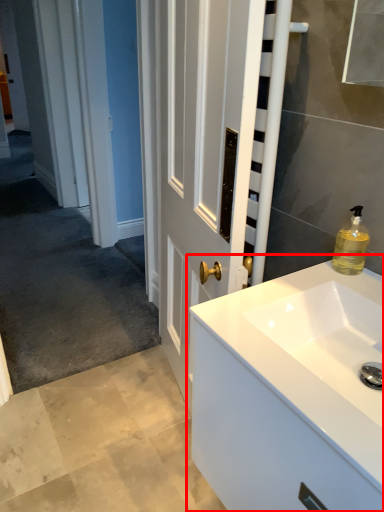
Question: From the image's perspective, what is the correct spatial relationship of bathroom cabinet (annotated by the red box) in relation to soap dispenser?

Choices:
 (A) below
 (B) above

Answer: (A)